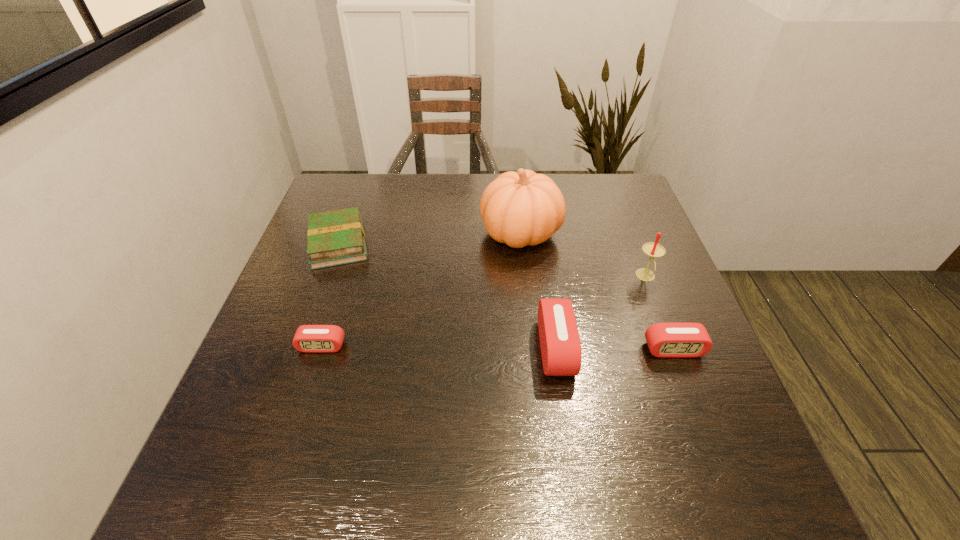
Locate an element on the screen. the leftmost alarm clock is located at coordinates (308, 338).

The height and width of the screenshot is (540, 960). Find the location of `the fourth shortest object`. the fourth shortest object is located at coordinates (561, 353).

This screenshot has height=540, width=960. I want to click on the tallest alarm clock, so click(561, 353).

Locate an element on the screen. The width and height of the screenshot is (960, 540). the second shortest alarm clock is located at coordinates [671, 340].

Where is `the rightmost alarm clock`? The width and height of the screenshot is (960, 540). the rightmost alarm clock is located at coordinates (671, 340).

Find the location of `the tallest object`. the tallest object is located at coordinates (521, 208).

I want to click on candle, so click(x=654, y=250).

I want to click on book, so click(x=337, y=237).

At what (x,y) coordinates should I click in order to perform the action: click on vacant space situated 0.110m on the front-facing side of the leftmost alarm clock. Please return your answer as a coordinate pair (x, y). Looking at the image, I should click on (304, 400).

Image resolution: width=960 pixels, height=540 pixels. In order to click on free space located on the front-facing side of the fourth shortest object in this screenshot , I will do `click(633, 348)`.